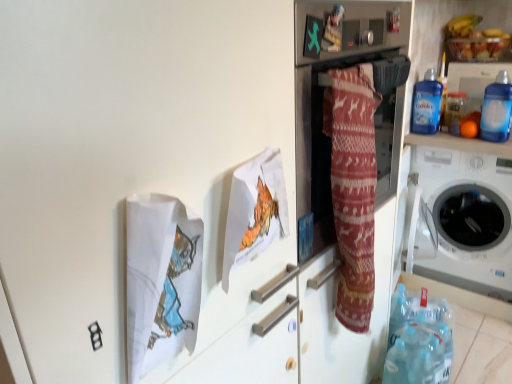
Measure the distance between point (441, 68) and camera.

Point (441, 68) is 2.00 meters from camera.

What do you see at coordinates (497, 109) in the screenshot? The image size is (512, 384). I see `blue plastic bottle at upper right, the 1th bottle viewed from the front` at bounding box center [497, 109].

What do you see at coordinates (464, 220) in the screenshot? This screenshot has width=512, height=384. I see `white plastic washing machine at right` at bounding box center [464, 220].

The height and width of the screenshot is (384, 512). Describe the element at coordinates (468, 129) in the screenshot. I see `orange matte at upper right` at that location.

Describe the element at coordinates (477, 48) in the screenshot. I see `translucent plastic bowl at upper right` at that location.

In order to face blue plastic bottles at upper right, should I rotate leftwards or rightwards?

Rotate right and turn 28.435 degrees.

At what (x,y) coordinates should I click in order to perform the action: click on patterned fabric at center. Please return your answer as a coordinate pair (x, y). Image resolution: width=512 pixels, height=384 pixels. Looking at the image, I should click on (330, 191).

Consider the image. From the image's perspective, between translucent plastic bowl at upper right and patterned fabric at center, which one is located above?

translucent plastic bowl at upper right, from the image's perspective.

Considering the relative sizes of translucent plastic bowl at upper right and patterned fabric at center in the image provided, is translucent plastic bowl at upper right smaller than patterned fabric at center?

Correct, translucent plastic bowl at upper right occupies less space than patterned fabric at center.

Which is farther, (447, 258) or (436, 119)?

Positioned behind is point (447, 258).

Identify the location of the 3rd bottle positioned above the white plastic washing machine at right (from the image's perspective). (426, 104).

From a real-world perspective, who is located lower, white plastic washing machine at right or blue plastic bottle at upper right, which appears as the 2th bottle when viewed from the front?

In real-world perspective, white plastic washing machine at right is lower.

How far apart are white plastic washing machine at right and blue plastic bottle at upper right, which appears as the 2th bottle when viewed from the front?

white plastic washing machine at right and blue plastic bottle at upper right, which appears as the 2th bottle when viewed from the front, are 17.49 inches apart.

Looking at this image, which object is positioned more to the right, blue plastic bottle at upper right, the 4th bottle from the front, or transparent plastic bottle at upper right, the 2th bottle in the back-to-front sequence?

Positioned to the right is blue plastic bottle at upper right, the 4th bottle from the front.

Which object is closer to the camera, blue plastic bottle at upper right, which ranks as the first bottle in back-to-front order, or transparent plastic bottle at upper right, the 2th bottle in the back-to-front sequence?

transparent plastic bottle at upper right, the 2th bottle in the back-to-front sequence.

Who is smaller, blue plastic bottle at upper right, which ranks as the first bottle in back-to-front order, or transparent plastic bottle at upper right, the 2th bottle in the back-to-front sequence?

blue plastic bottle at upper right, which ranks as the first bottle in back-to-front order, is smaller.

Consider the image. From the image's perspective, which one is positioned higher, blue plastic bottle at upper right, which ranks as the first bottle in back-to-front order, or transparent plastic bottle at upper right, the third bottle from the front?

blue plastic bottle at upper right, which ranks as the first bottle in back-to-front order, is shown above in the image.

Which of these two, patterned fabric at center or blue plastic bottle at upper right, marked as the third bottle in a back-to-front arrangement, is smaller?

blue plastic bottle at upper right, marked as the third bottle in a back-to-front arrangement, is smaller.

Is patterned fabric at center inside or outside of blue plastic bottle at upper right, which appears as the 2th bottle when viewed from the front?

patterned fabric at center exists outside the volume of blue plastic bottle at upper right, which appears as the 2th bottle when viewed from the front.

Between patterned fabric at center and blue plastic bottle at upper right, marked as the third bottle in a back-to-front arrangement, which one appears on the left side from the viewer's perspective?

Positioned to the left is patterned fabric at center.

Is patterned fabric at center oriented away from blue plastic bottle at upper right, marked as the third bottle in a back-to-front arrangement?

No.

Between point (382, 320) and point (468, 138), which one is positioned in front?

Positioned in front is point (382, 320).

Is patterned fabric at center facing towards orange matte at upper right?

No, patterned fabric at center is not aimed at orange matte at upper right.

Would you consider patterned fabric at center to be distant from orange matte at upper right?

patterned fabric at center is far away from orange matte at upper right.

Considering the sizes of objects patterned fabric at center and orange matte at upper right in the image provided, who is shorter, patterned fabric at center or orange matte at upper right?

Standing shorter between the two is orange matte at upper right.

Consider the image. Which is more distant, (487, 137) or (333, 364)?

The point (487, 137) is more distant.

From a real-world perspective, is blue plastic bottle at upper right, the 1th bottle viewed from the front, above or below patterned fabric at center?

Clearly, from a real-world perspective, blue plastic bottle at upper right, the 1th bottle viewed from the front, is above patterned fabric at center.

Based on the photo, how distant is blue plastic bottle at upper right, which is the 4th bottle from back to front, from patterned fabric at center?

They are 89.80 centimeters apart.

Considering the positions of objects blue plastic bottle at upper right, the 1th bottle viewed from the front, and patterned fabric at center in the image provided, who is in front, blue plastic bottle at upper right, the 1th bottle viewed from the front, or patterned fabric at center?

Positioned in front is patterned fabric at center.

Considering their positions, is white plastic washing machine at right located in front of or behind transparent plastic bottle at upper right, the third bottle from the front?

white plastic washing machine at right is positioned closer to the viewer than transparent plastic bottle at upper right, the third bottle from the front.

From the image's perspective, which one is positioned lower, white plastic washing machine at right or transparent plastic bottle at upper right, the 2th bottle in the back-to-front sequence?

white plastic washing machine at right appears lower in the image.

Looking at this image, measure the distance from white plastic washing machine at right to transparent plastic bottle at upper right, the 2th bottle in the back-to-front sequence.

white plastic washing machine at right is 18.16 inches from transparent plastic bottle at upper right, the 2th bottle in the back-to-front sequence.

Is white plastic washing machine at right turned away from transparent plastic bottle at upper right, the 2th bottle in the back-to-front sequence?

white plastic washing machine at right does not have its back to transparent plastic bottle at upper right, the 2th bottle in the back-to-front sequence.

At what (x,y) coordinates should I click in order to perform the action: click on fridge in front of the translucent plastic bowl at upper right. Please return your answer as a coordinate pair (x, y). Looking at the image, I should click on (330, 191).

I want to click on washing machine located underneath the blue plastic bottle at upper right, which appears as the 2th bottle when viewed from the front (from a real-world perspective), so click(464, 220).

Estimate the real-world distances between objects in this image. Which object is closer to white plastic washing machine at right, patterned fabric at center or blue plastic bottle at upper right, which is the 4th bottle from back to front?

Among the two, blue plastic bottle at upper right, which is the 4th bottle from back to front, is located nearer to white plastic washing machine at right.

Looking at the image, which one is located further to white plastic washing machine at right, blue plastic bottle at upper right, the 1th bottle viewed from the front, or transparent plastic bottle at upper right, the third bottle from the front?

transparent plastic bottle at upper right, the third bottle from the front, is positioned further to the anchor white plastic washing machine at right.

From the image, which object appears to be nearer to blue plastic bottle at upper right, the 4th bottle from the front, transparent plastic bottle at upper right, the 2th bottle in the back-to-front sequence, or patterned fabric at center?

transparent plastic bottle at upper right, the 2th bottle in the back-to-front sequence.

Which object lies nearer to the anchor point blue plastic bottle at upper right, marked as the third bottle in a back-to-front arrangement, white plastic washing machine at right or blue plastic bottles at upper right?

Among the two, blue plastic bottles at upper right is located nearer to blue plastic bottle at upper right, marked as the third bottle in a back-to-front arrangement.

Considering their positions, is blue plastic bottle at upper right, marked as the third bottle in a back-to-front arrangement, positioned further to patterned fabric at center than blue plastic bottle at upper right, the 4th bottle from the front?

blue plastic bottle at upper right, the 4th bottle from the front, is further to patterned fabric at center.

Estimate the real-world distances between objects in this image. Which object is closer to blue plastic bottle at upper right, the 1th bottle viewed from the front, blue plastic bottle at upper right, marked as the third bottle in a back-to-front arrangement, or patterned fabric at center?

blue plastic bottle at upper right, marked as the third bottle in a back-to-front arrangement, lies closer to blue plastic bottle at upper right, the 1th bottle viewed from the front, than the other object.

Looking at the image, which one is located closer to blue plastic bottle at upper right, the 4th bottle from the front, blue plastic bottle at upper right, which is the 4th bottle from back to front, or orange matte at upper right?

Among the two, orange matte at upper right is located nearer to blue plastic bottle at upper right, the 4th bottle from the front.

When comparing their distances from blue plastic bottle at upper right, marked as the third bottle in a back-to-front arrangement, does blue plastic bottle at upper right, which is the 4th bottle from back to front, or transparent plastic bottle at upper right, the third bottle from the front, seem closer?

transparent plastic bottle at upper right, the third bottle from the front, lies closer to blue plastic bottle at upper right, marked as the third bottle in a back-to-front arrangement, than the other object.

Locate an element on the screen. bowl between blue plastic bottle at upper right, marked as the third bottle in a back-to-front arrangement, and blue plastic bottles at upper right, in the horizontal direction is located at coordinates (477, 48).

The image size is (512, 384). I want to click on bottle between transparent plastic bottle at upper right, the 2th bottle in the back-to-front sequence, and white plastic washing machine at right vertically, so click(497, 109).

You are a GUI agent. You are given a task and a screenshot of the screen. Output one action in this format:
    pyautogui.click(x=<x>, y=<y>)
    Task: Click on the appliance between blue plastic bottle at upper right, the 1th bottle viewed from the front, and blue plastic bottle at upper right, the 4th bottle from the front, along the z-axis
    The image size is (512, 384).
    Given the screenshot: What is the action you would take?
    [x=474, y=76]

Where is `orange between transparent plastic bottle at upper right, the third bottle from the front, and white plastic washing machine at right from top to bottom`? The height and width of the screenshot is (384, 512). orange between transparent plastic bottle at upper right, the third bottle from the front, and white plastic washing machine at right from top to bottom is located at coordinates (468, 129).